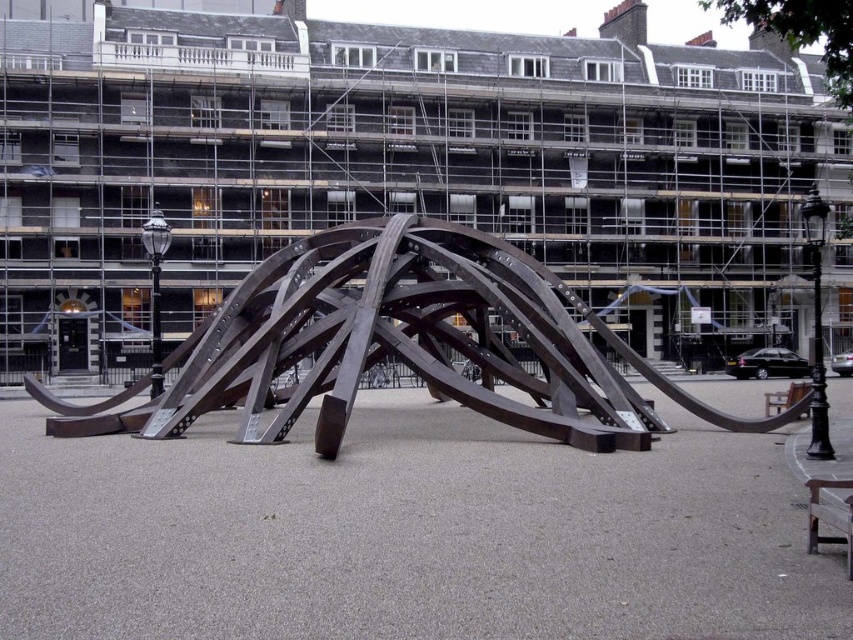
Between wooden bench at lower right and wooden park bench at lower right, which one has less height?

wooden bench at lower right

Is wooden bench at lower right to the right of wooden park bench at lower right from the viewer's perspective?

In fact, wooden bench at lower right is to the left of wooden park bench at lower right.

I want to click on wooden bench at lower right, so click(830, 515).

Locate an element on the screen. The image size is (853, 640). wooden bench at lower right is located at coordinates 830,515.

Which is more to the right, brown metallic sculpture at center or wooden bench at lower right?

From the viewer's perspective, wooden bench at lower right appears more on the right side.

Does brown metallic sculpture at center have a lesser width compared to wooden bench at lower right?

No.

The height and width of the screenshot is (640, 853). What are the coordinates of `brown metallic sculpture at center` in the screenshot? It's located at click(x=398, y=342).

Between brown metallic sculpture at center and wooden park bench at lower right, which one is positioned higher?

Positioned higher is brown metallic sculpture at center.

Is brown metallic sculpture at center wider than wooden park bench at lower right?

Yes, brown metallic sculpture at center is wider than wooden park bench at lower right.

Is point (563, 394) behind point (776, 403)?

No, it is not.

The height and width of the screenshot is (640, 853). In order to click on brown metallic sculpture at center in this screenshot , I will do (398, 342).